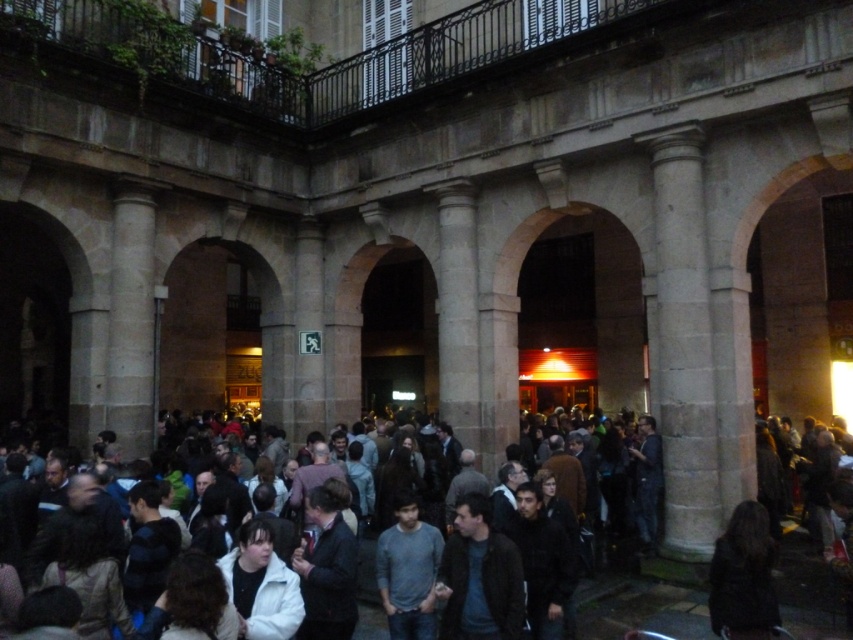
Which of these two, dark clothing crowd at center or gray cotton shirt at center, stands taller?

dark clothing crowd at center is taller.

Who is higher up, dark clothing crowd at center or gray cotton shirt at center?

dark clothing crowd at center

Find the location of `dark clothing crowd at center`. dark clothing crowd at center is located at coordinates [625, 573].